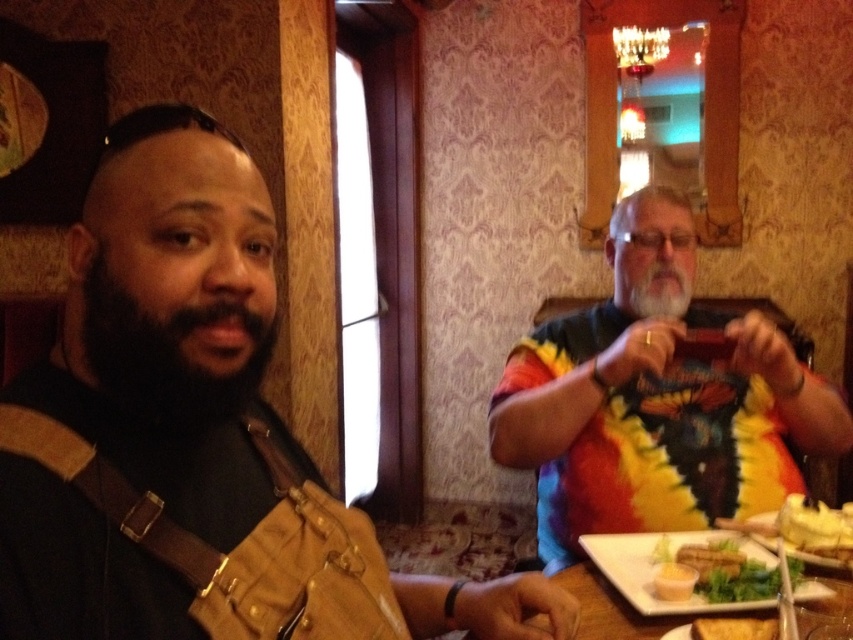
You are setting up a table in a restaurant and need to place a decorative item between the white ceramic plate at lower right and the white soft beard at center. Which object should you place closer to the edge of the table to ensure the decorative item fits?

The white ceramic plate at lower right might be wider than the white soft beard at center, so placing the decorative item closer to the edge near the white ceramic plate at lower right would ensure it fits better.

You are a photographer setting up a shot in this dining area. You need to position your camera so that the black fuzzy beard at left and the golden crispy bread at lower right are both in frame. Based on their positions, which object should you adjust your camera angle to focus on first to ensure both are visible?

Since the black fuzzy beard at left is to the left of the golden crispy bread at lower right, you should first focus on the black fuzzy beard at left to ensure both objects remain in frame as you adjust your camera angle.